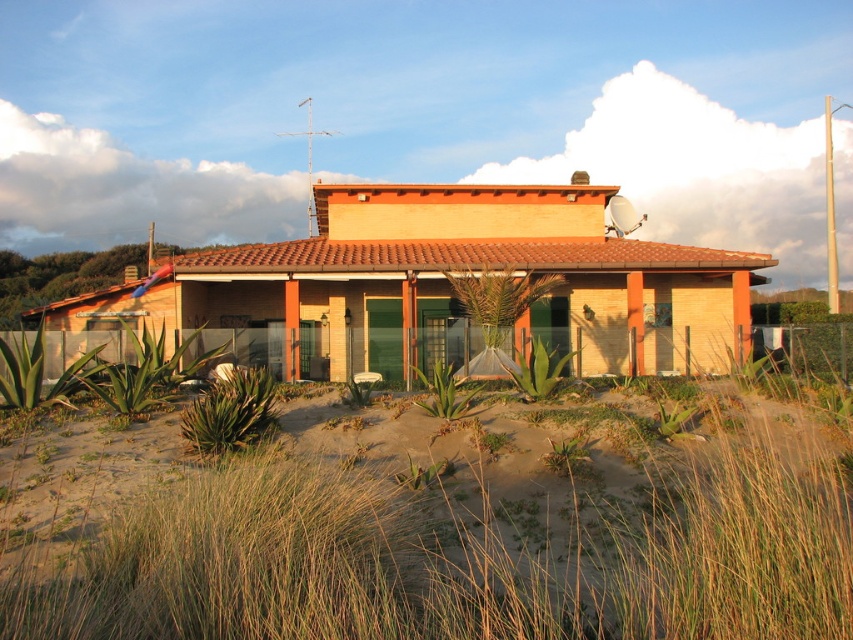
You are standing in front of the matte orange house at center and want to walk to the brown sandy beach at lower center. Which direction should you head towards?

The brown sandy beach at lower center is to the right of the matte orange house at center, so you should head towards the right to reach it.

You are standing in front of the house and want to determine the relative positions of two points marked on the sandy area. Which point, point (714,476) or point (526,253), is closer to you?

Point (714,476) is closer to the camera than point (526,253).

You are standing in front of the house and want to reach a specific point marked at coordinates point [550,497]. If you can walk 5 meters per minute, how long will it take you to reach that point?

The distance to point [550,497] is 8.00 meters. At a walking speed of 5 meters per minute, it will take 1.6 minutes to reach the point.